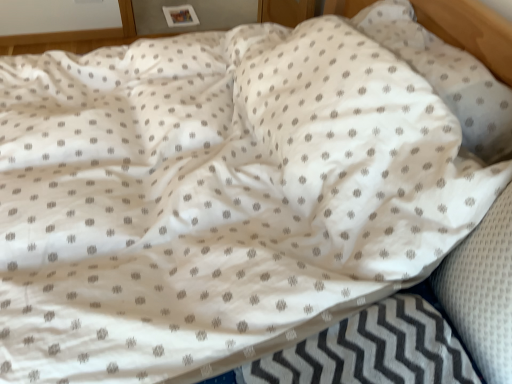
What do you see at coordinates (447, 77) in the screenshot?
I see `white fabric pillow at upper center` at bounding box center [447, 77].

The width and height of the screenshot is (512, 384). I want to click on white fabric pillow at upper center, so click(x=447, y=77).

Find the location of a particular element. Image resolution: width=512 pixels, height=384 pixels. white fabric pillow at upper center is located at coordinates (447, 77).